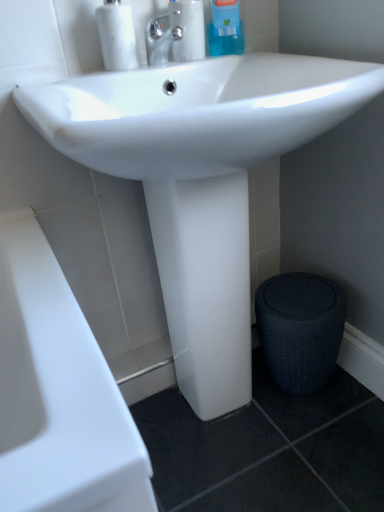
Where is `vacant point above textured dark gray stool at lower right (from a real-world perspective)`? vacant point above textured dark gray stool at lower right (from a real-world perspective) is located at coordinates (297, 296).